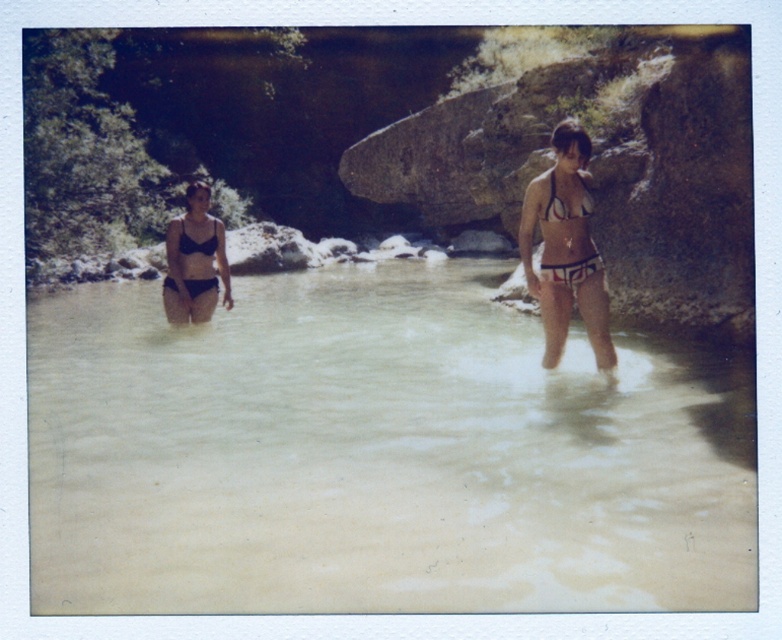
Looking at this image, you are a photographer trying to capture a closeup shot of both the matte black bikini at center and the black matte bikini top at center. Given that your camera can focus on objects within a 2.5 inch range, will you be able to capture both subjects in focus?

The matte black bikini at center is 2.96 inches away from the black matte bikini top at center. Since the distance between them exceeds the camera focus range of 2.5 inches, you will not be able to capture both subjects in focus simultaneously.

You are a photographer planning to take a group photo of the two individuals wearing the white matte bikini at right and the black matte bikini top at center. Given that the camera you have can capture a maximum distance of 5 meters between subjects, will you be able to frame both individuals in the same shot?

The white matte bikini at right and black matte bikini top at center are 4.44 meters apart from each other, which is within the camera maximum distance of 5 meters. Therefore, you can frame both individuals in the same shot.

You are a photographer trying to capture the two individuals in the scene. Since the matte black bikini at center and the black matte bikini top at center are both in the frame, which one appears larger in the photo?

The matte black bikini at center appears larger in the photo because it is taller than the black matte bikini top at center.